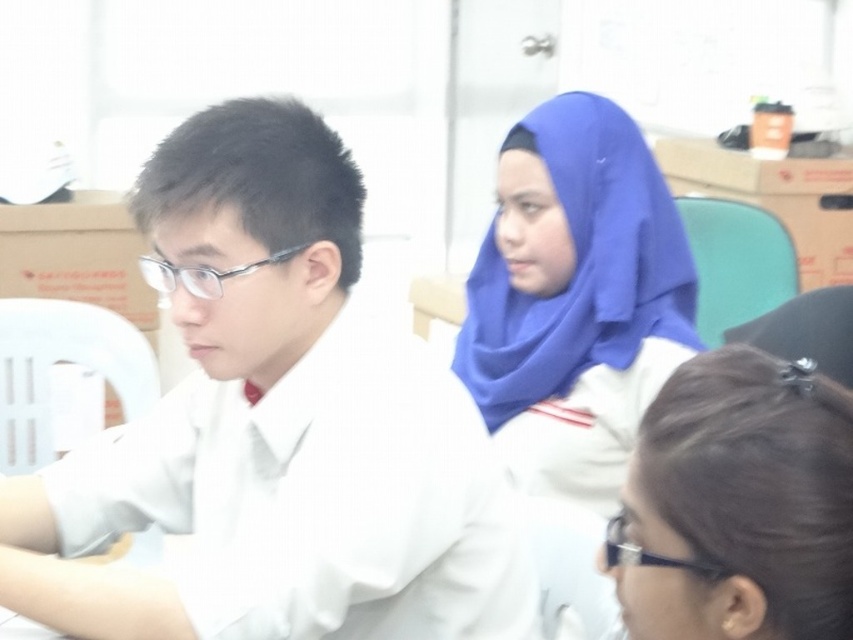
You are a photographer in the classroom and want to take a photo of the white matte shirt at left and the blue fabric veil at upper center. Considering their heights, which object should you adjust your camera angle to focus on first?

The white matte shirt at left has a greater height compared to the blue fabric veil at upper center, so you should focus on the white matte shirt at left first to ensure proper framing.

You are standing in the classroom and need to hand a note to the student wearing the white matte shirt at left. Based on their position relative to other objects in the scene, where should you approach from?

The white matte shirt at left is located at point coordinates, so you should approach from the left side to reach them effectively.